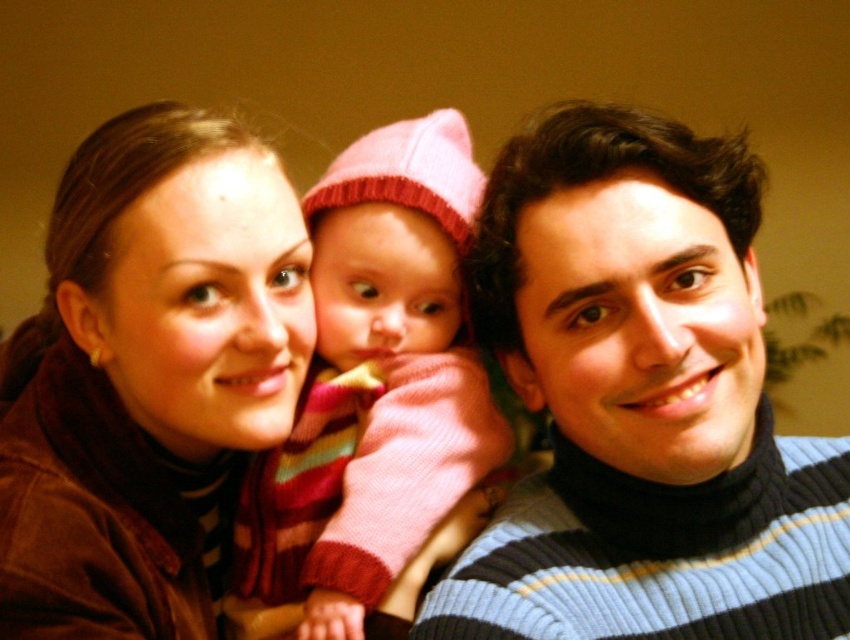
Question: Can you confirm if striped knit sweater at center is wider than brown suede jacket at left?

Choices:
 (A) yes
 (B) no

Answer: (A)

Question: Considering the relative positions of brown suede jacket at left and pink knitted hat at center in the image provided, where is brown suede jacket at left located with respect to pink knitted hat at center?

Choices:
 (A) above
 (B) below

Answer: (B)

Question: Which is nearer to the brown suede jacket at left?

Choices:
 (A) pink knitted hat at center
 (B) striped knit sweater at center

Answer: (A)

Question: Does brown suede jacket at left have a larger size compared to pink knitted hat at center?

Choices:
 (A) yes
 (B) no

Answer: (A)

Question: Among these points, which one is nearest to the camera?

Choices:
 (A) (758, 612)
 (B) (109, 120)

Answer: (A)

Question: Which of the following is the farthest from the observer?

Choices:
 (A) (180, 378)
 (B) (588, 614)
 (C) (332, 180)

Answer: (C)